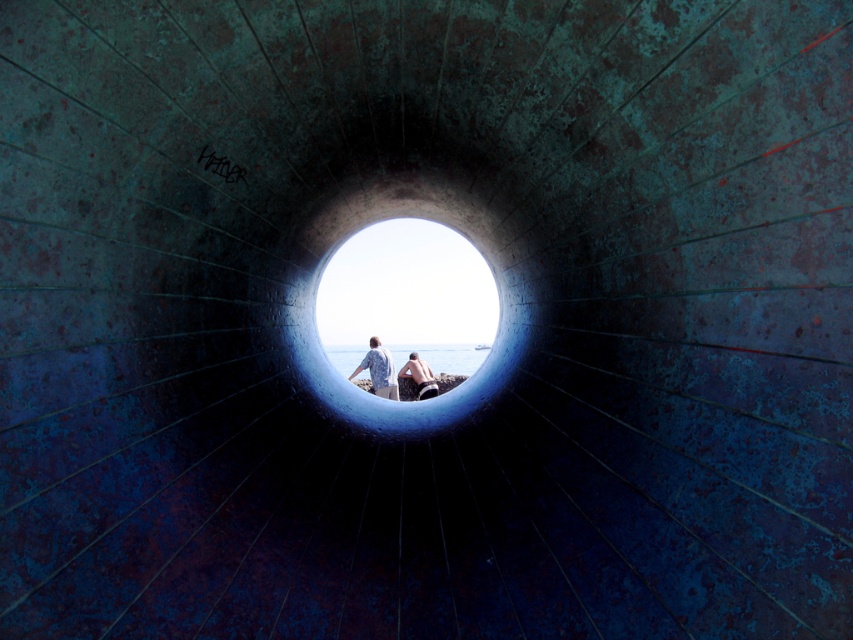
You are inside a dark tunnel with two points marked on the wall in front of you. The coordinates are point (399, 256) and point (405, 364). If you want to touch the point that is closer to you, which one should you choose?

Point (405, 364) is closer to you because it is less further than point (399, 256), which is further away according to the description.

You are a safety inspector checking the tunnel structure. The safety regulations state that there must be at least 3 meters of distance between any opening and personnel working nearby to prevent accidents. Based on the image, is the distance between the smooth concrete hole at center and the smooth skin person at center compliant with the safety regulations?

The smooth concrete hole at center and the smooth skin person at center are 2.81 meters apart from each other. Since the required distance is 3 meters, the current separation is 0.19 meters shorter than the regulation, so it does not comply with the safety regulations.